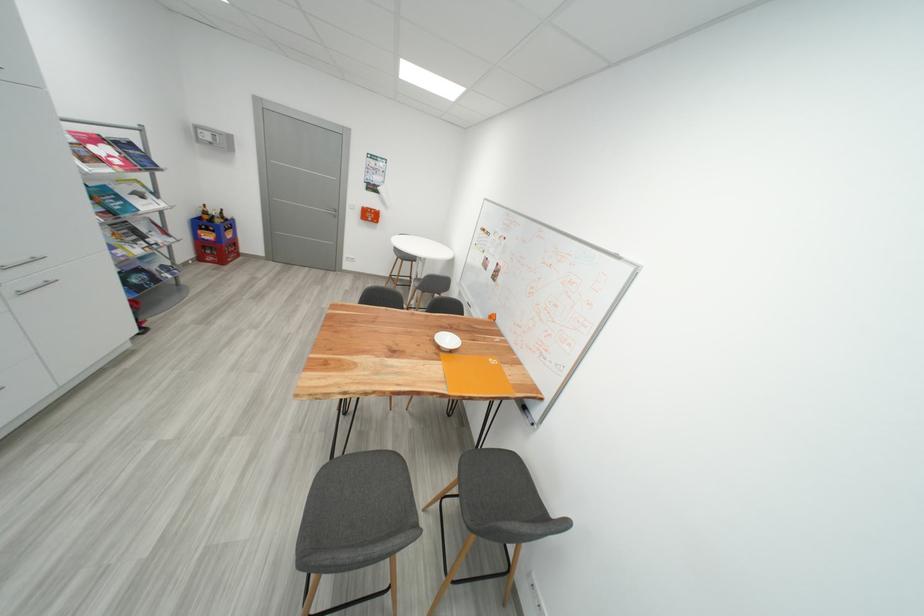
The location [113,200] corresponds to which object?

It corresponds to the blue magazine in the image.